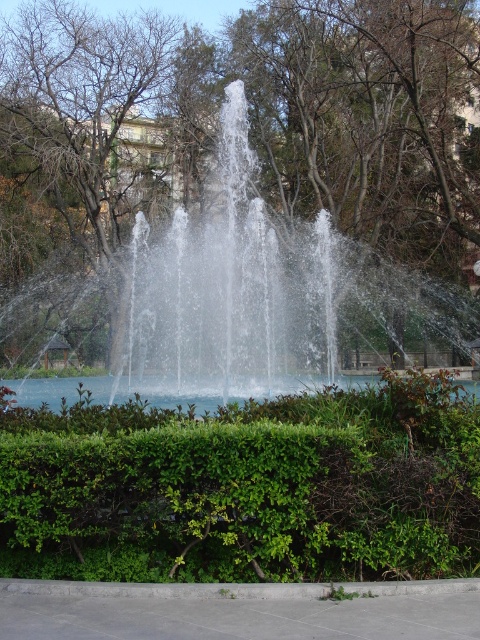
You are standing in the park and see the green leafy hedge at center and the clear water fountain at center. Which object is located to the right of the other?

The green leafy hedge at center is positioned on the right side of clear water fountain at center.

You are a landscape architect designing a new garden. You want to place a decorative statue between the clear water fountain at center and the clear water at center. Which object should the statue be closer to if you want it to be equidistant from both? Please explain your reasoning based on their widths.

The statue should be closer to the clear water at center because the clear water fountain at center is wider. To be equidistant from both, the statue must be placed nearer to the narrower object, which is the clear water at center, as the fountain occupies more space.

You are standing at the fountain and want to take a photo of both the point at coordinates point (x=71, y=337) and point (x=478, y=397). Which point will appear closer to the camera in the photo?

Point (x=478, y=397) will appear closer to the camera because it is in front of point (x=71, y=337).